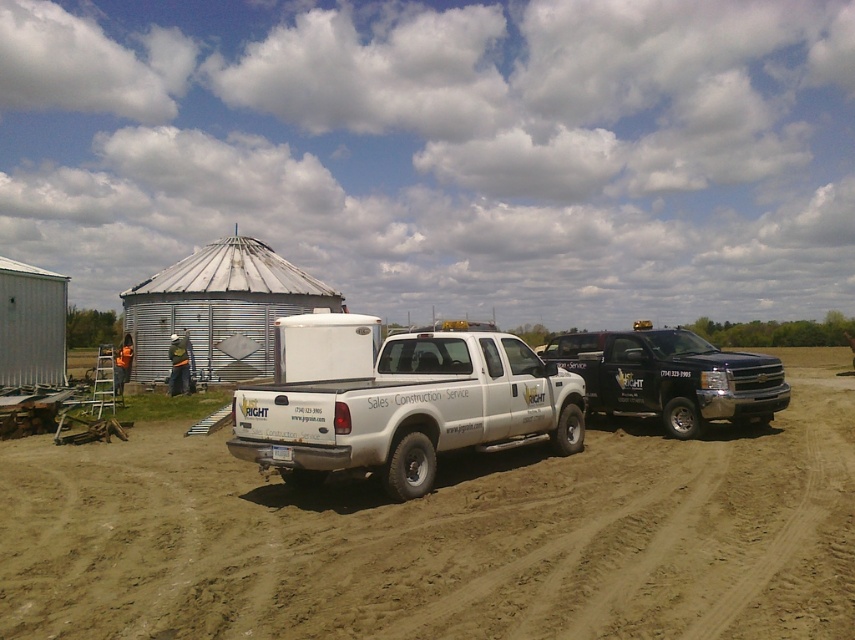
You are a delivery driver who needs to park your truck near the white matte truck at center without blocking the entrance. According to the spatial coordinates provided, where should you position your truck to ensure it doesn

The white matte truck at center is located at coordinates point (397, 400). To park without blocking the entrance, position your truck to the right of the white matte truck at center since it is already centrally positioned.

You are a farmer standing on the dirt field at center. You want to see the top of the white matte truck at center. Can you see it without moving from your current position?

The dirt field at center has a lesser height compared to white matte truck at center, so yes, you can see the top of the white matte truck at center from your current position on the dirt field at center.

You are a farmer who needs to park your tractor in the dirt field at center. However, there is a black glossy truck at right currently occupying the space. Can you park your tractor there without moving the truck?

The dirt field at center is positioned under the black glossy truck at right, meaning the truck is parked over the dirt field. Therefore, you cannot park your tractor there without moving the truck.